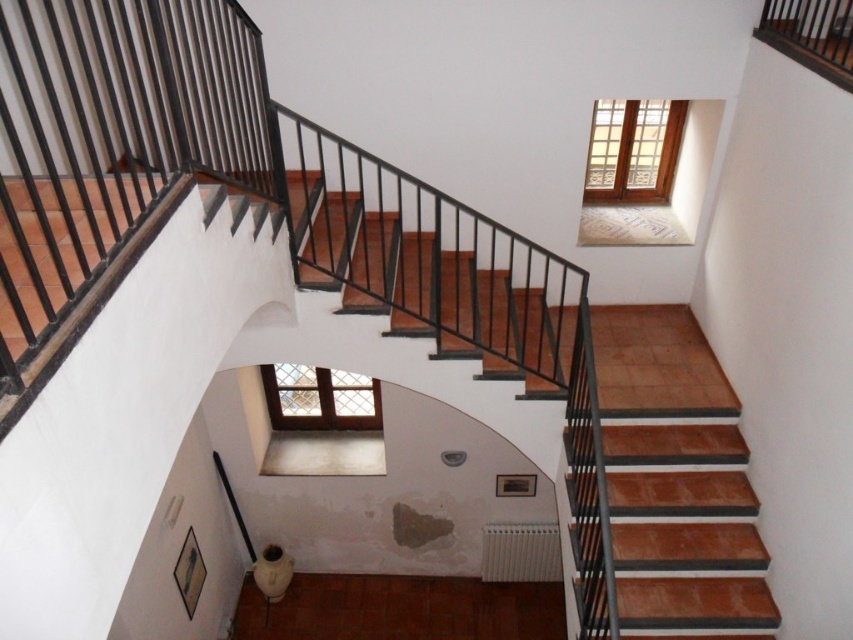
You are standing at the base of the staircase and want to know the exact position of the clear glass window at upper right. What are its coordinates?

The clear glass window at upper right is located at coordinates (631, 150).

You are an architect assessing the structural integrity of the clear glass window at upper right and the clear glass window at center. Which window has a greater width between its edges?

The clear glass window at center has a greater width between its edges than the clear glass window at upper right since it is thicker.

You are standing at the bottom of the staircase and want to look through one of the windows. Which window, the clear glass window at upper right or the clear glass window at center, is positioned to your right side?

A: The clear glass window at upper right is to the right of the clear glass window at center, so from your position at the bottom of the staircase, the clear glass window at upper right would be on your right side.